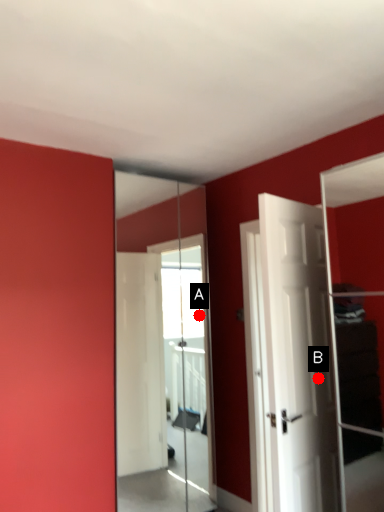
Question: Two points are circled on the image, labeled by A and B beside each circle. Which of the following is the farthest from the observer?

Choices:
 (A) A is further
 (B) B is further

Answer: (A)